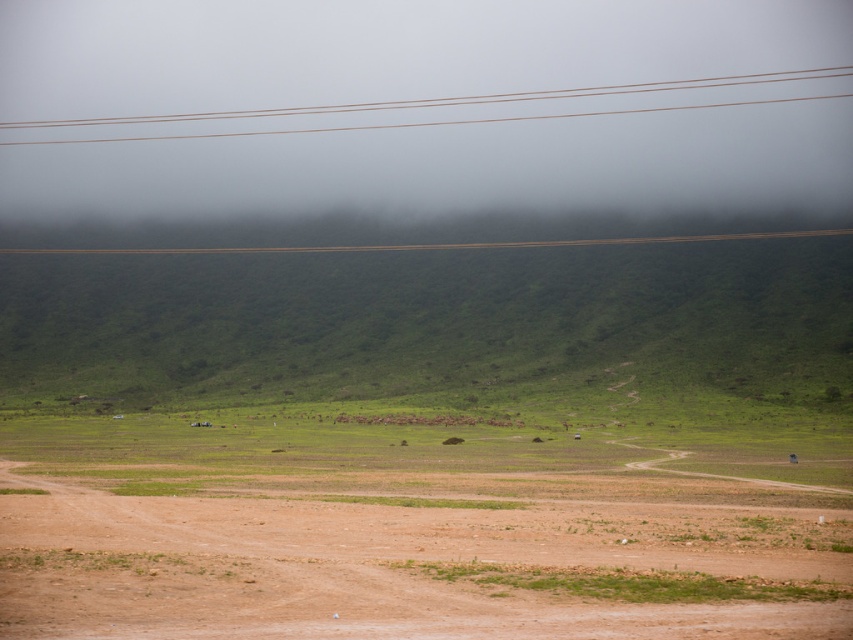
Can you confirm if brown sandy dirt field at lower left is positioned to the right of brown/wooden power lines at upper center?

Yes, brown sandy dirt field at lower left is to the right of brown/wooden power lines at upper center.

Who is more forward, (654, 560) or (202, 134)?

Point (654, 560)

Find the location of a particular element. brown sandy dirt field at lower left is located at coordinates (399, 566).